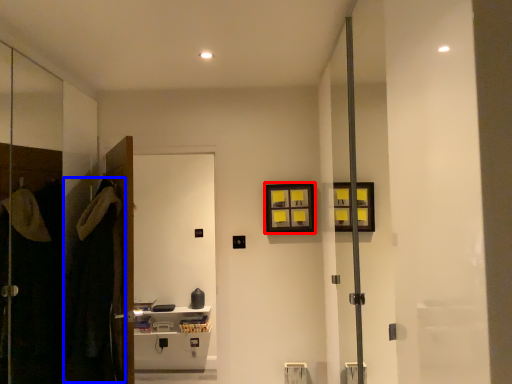
Question: Which point is further to the camera, picture frame (highlighted by a red box) or robe (highlighted by a blue box)?

Choices:
 (A) picture frame
 (B) robe

Answer: (A)